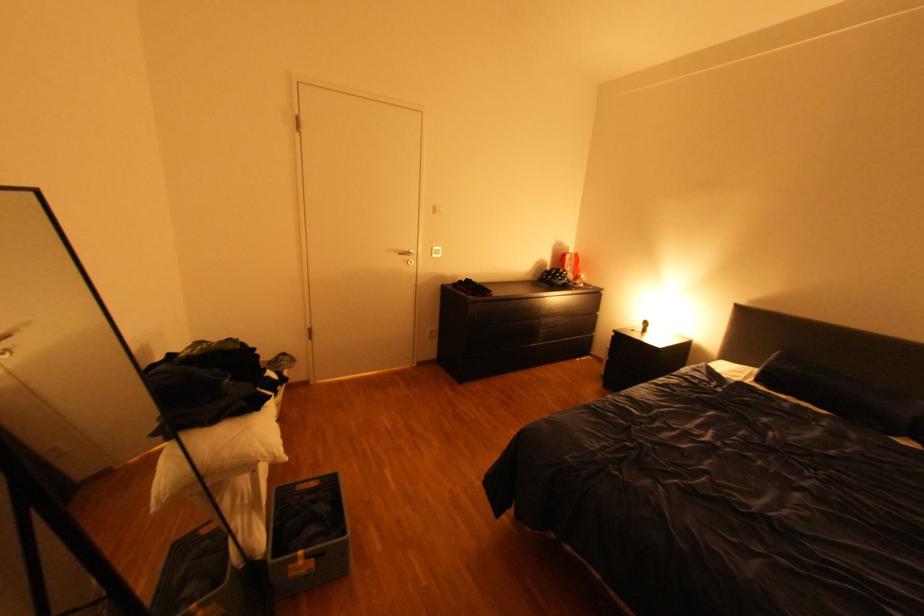
What do you see at coordinates (435, 252) in the screenshot? This screenshot has width=924, height=616. I see `the white light switch` at bounding box center [435, 252].